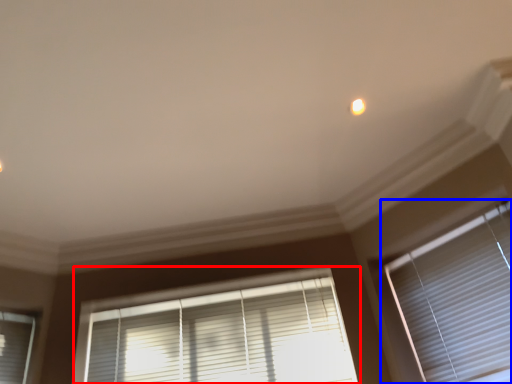
Question: Among these objects, which one is farthest to the camera, window blind (highlighted by a red box) or window blind (highlighted by a blue box)?

Choices:
 (A) window blind
 (B) window blind

Answer: (A)